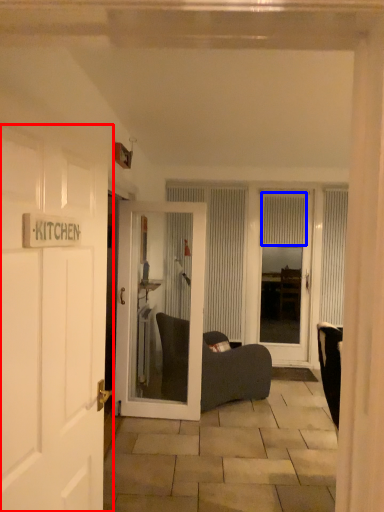
Question: Among these objects, which one is farthest to the camera, door (highlighted by a red box) or curtain (highlighted by a blue box)?

Choices:
 (A) door
 (B) curtain

Answer: (B)